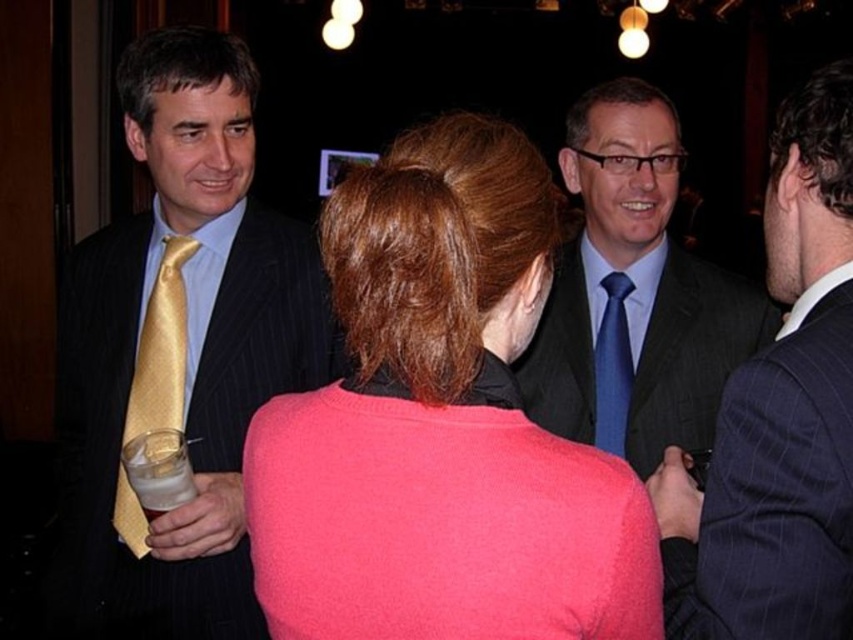
Can you confirm if matte black suit at right is taller than gold silk tie at left?

Yes.

Between point (749, 545) and point (143, 364), which one is positioned in front?

Point (749, 545)

Describe the element at coordinates (779, 416) in the screenshot. This screenshot has width=853, height=640. I see `matte black suit at right` at that location.

This screenshot has width=853, height=640. Identify the location of matte black suit at right. (779, 416).

Who is more distant from viewer, (482,588) or (607,310)?

Point (607,310)

Where is `pink woolen sweater at center`? Image resolution: width=853 pixels, height=640 pixels. pink woolen sweater at center is located at coordinates (440, 426).

Does point (711, 360) come closer to viewer compared to point (608, 394)?

Yes, it is.

Who is higher up, blue silk suit at center or blue silk tie at center?

blue silk suit at center

Which is behind, point (619, 230) or point (624, 275)?

The point (624, 275) is more distant.

Image resolution: width=853 pixels, height=640 pixels. In order to click on blue silk suit at center in this screenshot , I will do `click(634, 294)`.